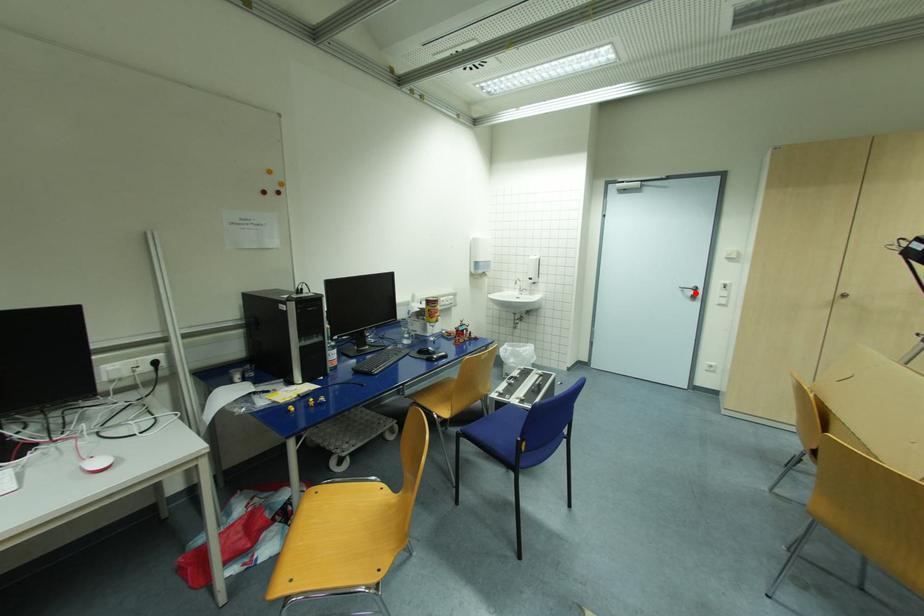
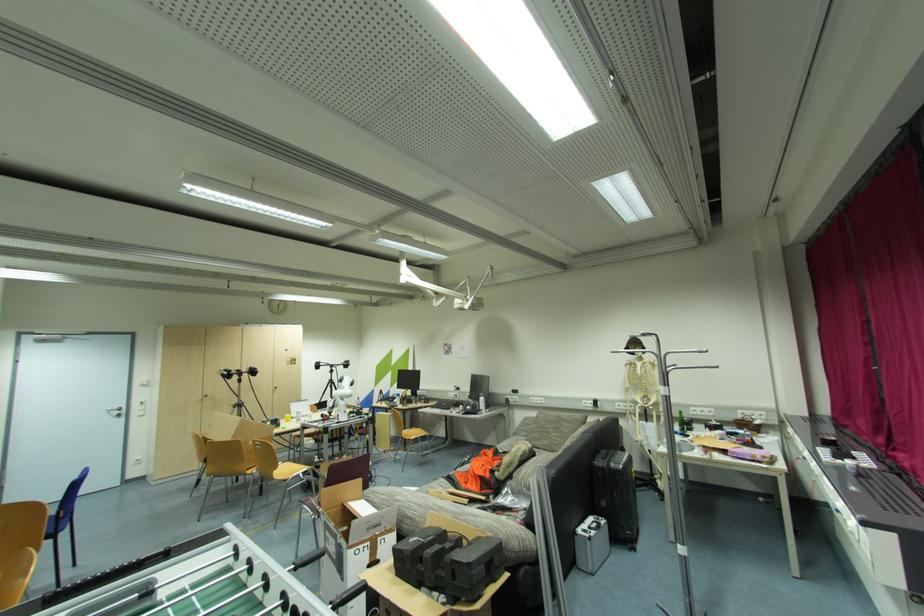
The point at the highlighted location is marked in the first image. Where is the corresponding point in the second image?

(122, 413)